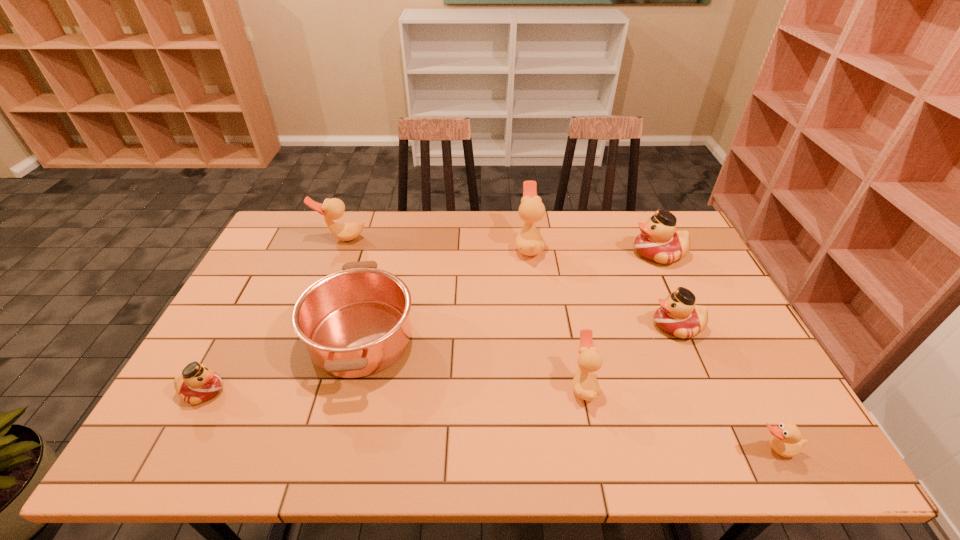
The image size is (960, 540). I want to click on vacant space located 0.200m on the beak of the leftmost tan duck, so click(x=324, y=285).

I want to click on vacant space situated 0.280m on the face of the second farthest red duck, so click(x=552, y=326).

The image size is (960, 540). I want to click on vacant space located on the face of the second farthest red duck, so click(x=630, y=326).

Locate an element on the screen. The width and height of the screenshot is (960, 540). vacant space situated 0.100m on the face of the second farthest red duck is located at coordinates (615, 326).

What are the coordinates of `free spot located 0.080m on the beak of the third biggest tan duck` in the screenshot? It's located at (539, 385).

Find the location of `vacant area situated on the beak of the third biggest tan duck`. vacant area situated on the beak of the third biggest tan duck is located at coordinates (410, 385).

Where is `free space located 0.370m on the beak of the third biggest tan duck`? This screenshot has width=960, height=540. free space located 0.370m on the beak of the third biggest tan duck is located at coordinates (421, 385).

You are a GUI agent. You are given a task and a screenshot of the screen. Output one action in this format:
    pyautogui.click(x=<x>, y=<y>)
    Task: Click on the vacant area situated on the back of the saucepan
    The width and height of the screenshot is (960, 540).
    Given the screenshot: What is the action you would take?
    pyautogui.click(x=382, y=258)

At what (x,y) coordinates should I click in order to perform the action: click on free spot located 0.170m on the face of the nearest red duck. Please return your answer as a coordinate pair (x, y). Image resolution: width=960 pixels, height=540 pixels. Looking at the image, I should click on (295, 391).

Identify the location of object located in the near edge section of the desktop. [x=787, y=441].